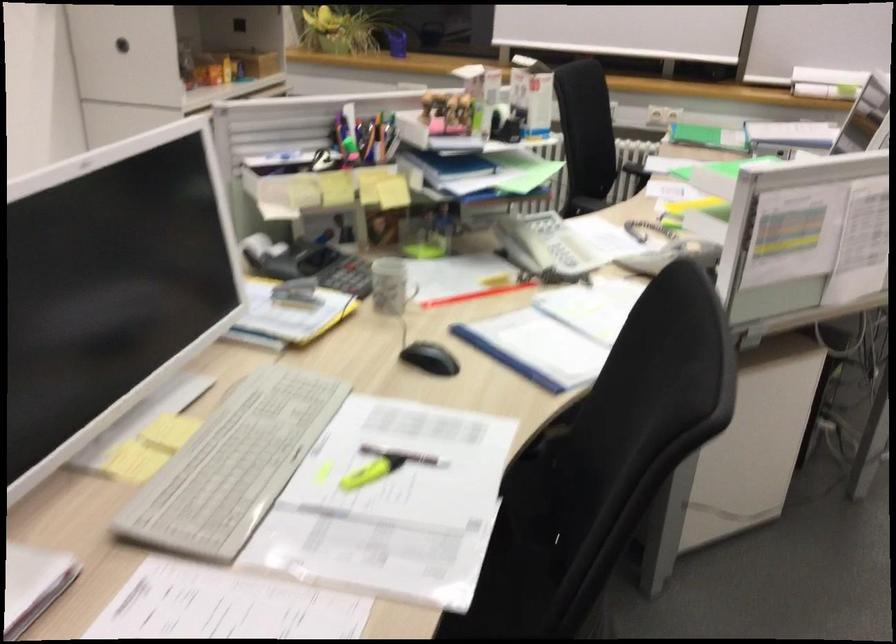
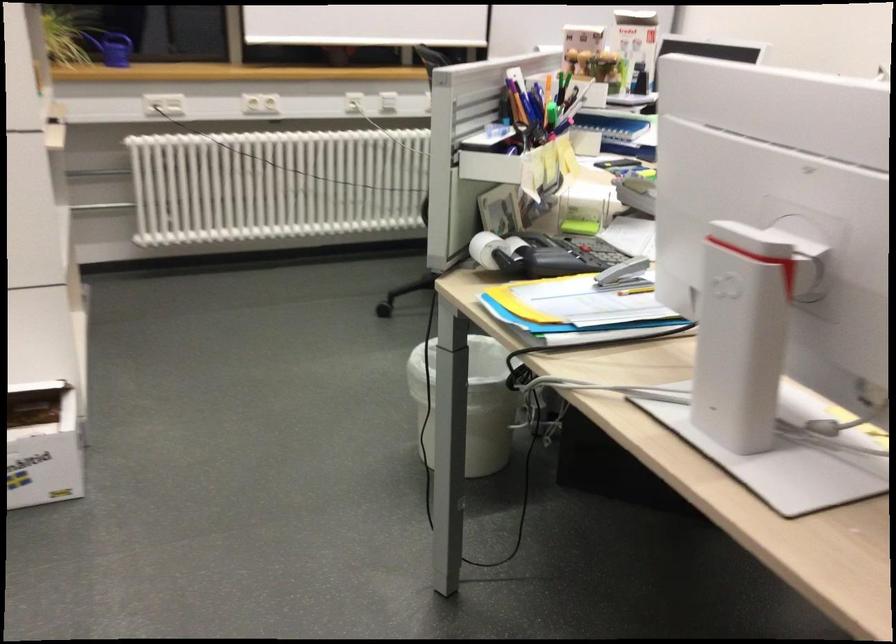
Where in the second image is the point corresponding to the point at 245,249 from the first image?

(485, 249)